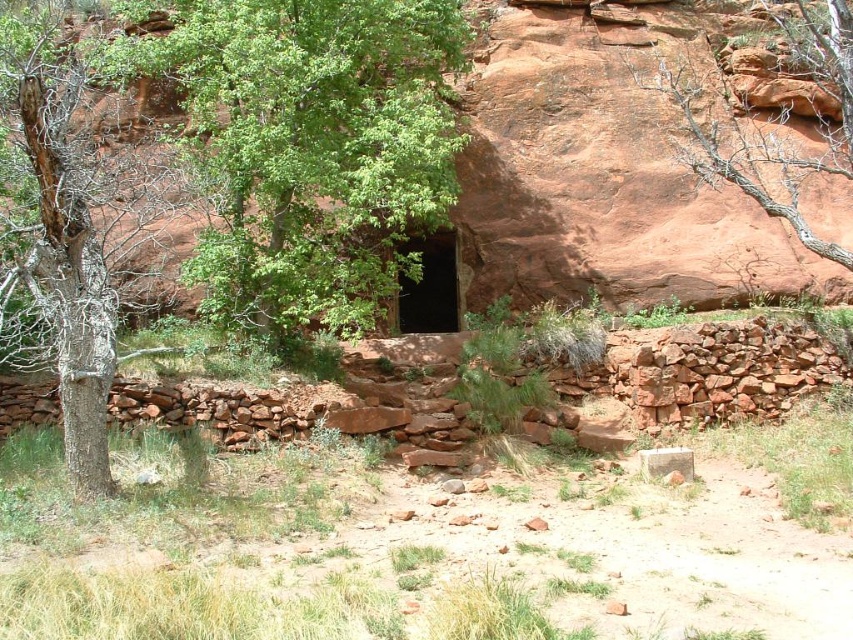
Is point (82, 68) positioned behind point (399, 252)?

No, it is in front of (399, 252).

Is point (27, 6) farther from viewer compared to point (434, 262)?

That is False.

You are a GUI agent. You are given a task and a screenshot of the screen. Output one action in this format:
    pyautogui.click(x=<x>, y=<y>)
    Task: Click on the dead wood tree at left
    The image size is (853, 640).
    Given the screenshot: What is the action you would take?
    pyautogui.click(x=86, y=202)

Is the position of bare wood tree at upper right less distant than that of black stone entrance at center?

No, bare wood tree at upper right is further to the viewer.

Is bare wood tree at upper right wider than black stone entrance at center?

Yes.

Is point (699, 154) less distant than point (410, 308)?

That is True.

At what (x,y) coordinates should I click in order to perform the action: click on bare wood tree at upper right. Please return your answer as a coordinate pair (x, y). This screenshot has height=640, width=853. Looking at the image, I should click on (772, 134).

Which of these two, green leafy tree at center or black stone entrance at center, stands taller?

green leafy tree at center

Is green leafy tree at center behind black stone entrance at center?

That is False.

Who is more distant from viewer, (321, 147) or (440, 316)?

The point (440, 316) is more distant.

The width and height of the screenshot is (853, 640). What are the coordinates of `green leafy tree at center` in the screenshot? It's located at (308, 147).